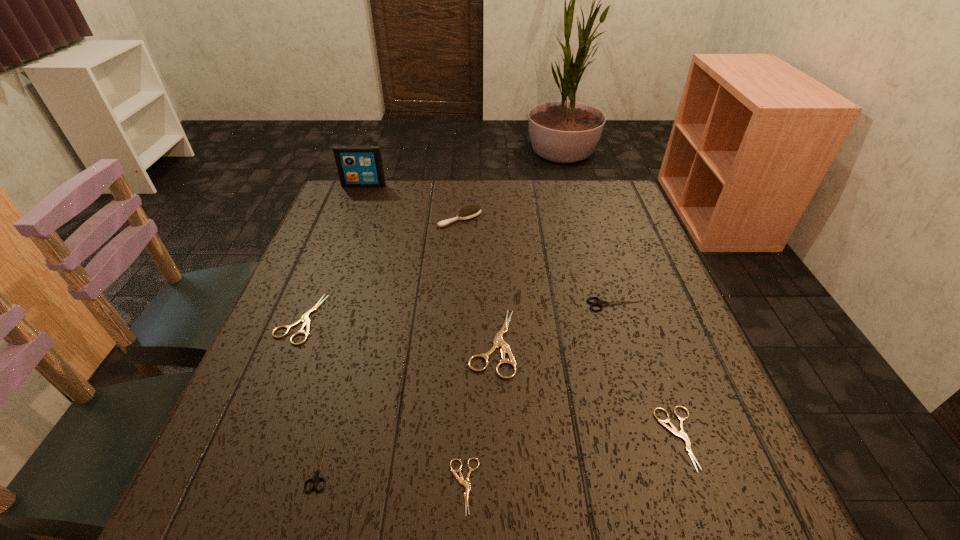
Locate an element on the screen. The height and width of the screenshot is (540, 960). blank space that satisfies the following two spatial constraints: 1. on the front screen of the left black shears; 2. on the right side of the iPod is located at coordinates (258, 464).

Where is `free space that satisfies the following two spatial constraints: 1. on the front screen of the second smallest beige shears; 2. on the right side of the farthest object`? The image size is (960, 540). free space that satisfies the following two spatial constraints: 1. on the front screen of the second smallest beige shears; 2. on the right side of the farthest object is located at coordinates (268, 438).

The width and height of the screenshot is (960, 540). I want to click on free space in the image that satisfies the following two spatial constraints: 1. on the front screen of the seventh shortest object; 2. on the left side of the farthest object, so click(x=351, y=219).

This screenshot has width=960, height=540. I want to click on free space that satisfies the following two spatial constraints: 1. on the front screen of the smaller black shears; 2. on the left side of the farthest object, so click(x=258, y=464).

Locate an element on the screen. free space that satisfies the following two spatial constraints: 1. on the back side of the bigger black shears; 2. on the right side of the second shears from left to right is located at coordinates (364, 305).

Find the location of a particular element. The height and width of the screenshot is (540, 960). vacant space that satisfies the following two spatial constraints: 1. on the back side of the leftmost shears; 2. on the left side of the farther black shears is located at coordinates (306, 305).

Locate an element on the screen. vacant space that satisfies the following two spatial constraints: 1. on the front side of the second smallest beige shears; 2. on the left side of the scrubbing brush is located at coordinates (447, 438).